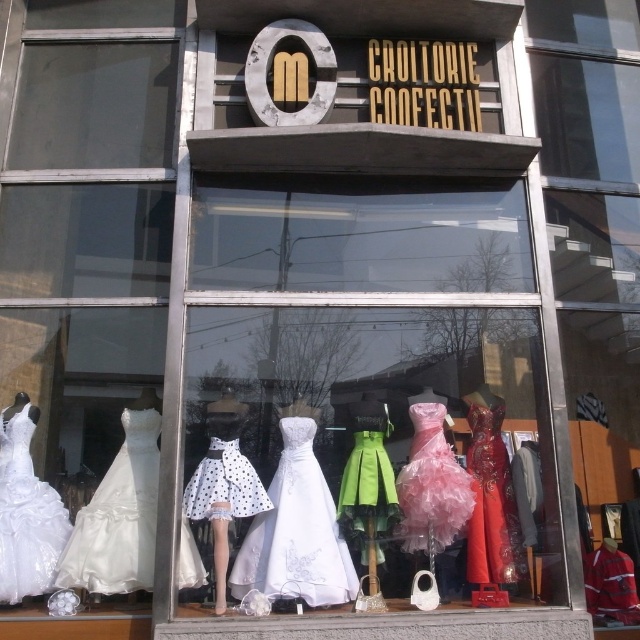
Question: Which object is closer to the camera taking this photo?

Choices:
 (A) ivory satin dress at lower left
 (B) white satin dress at center

Answer: (A)

Question: From the image, what is the correct spatial relationship of white satin dress at left in relation to white polka dot skirt at center?

Choices:
 (A) above
 (B) below

Answer: (B)

Question: Estimate the real-world distances between objects in this image. Which object is farther from the ivory satin dress at lower left?

Choices:
 (A) white satin dress at center
 (B) pink satin dress at center

Answer: (B)

Question: Which of these objects is positioned farthest from the white satin dress at left?

Choices:
 (A) white polka dot skirt at center
 (B) ivory satin dress at lower left
 (C) shiny red dress at center

Answer: (C)

Question: Can you confirm if white satin dress at center is bigger than white polka dot skirt at center?

Choices:
 (A) yes
 (B) no

Answer: (B)

Question: Is pink satin dress at center thinner than white polka dot skirt at center?

Choices:
 (A) yes
 (B) no

Answer: (A)